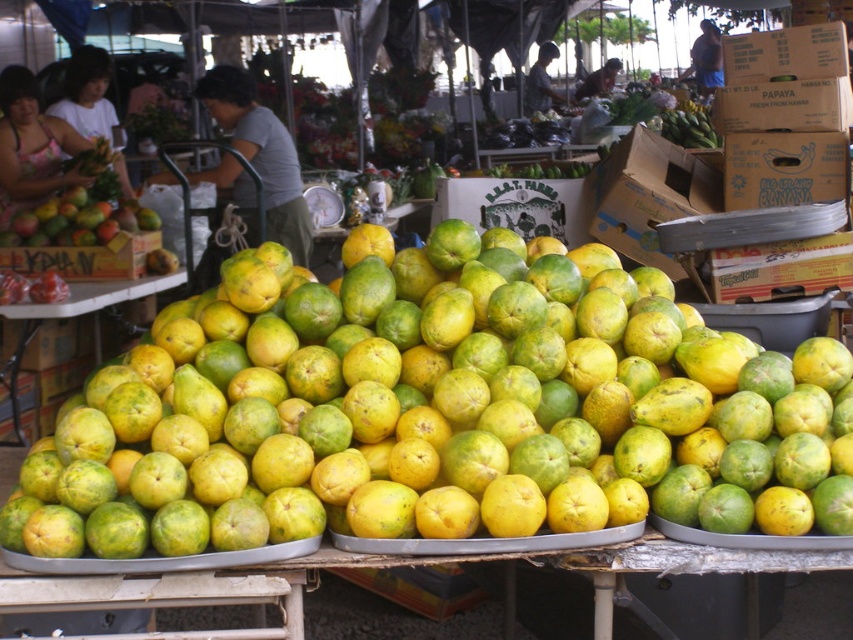
Who is positioned more to the right, green matte papaya at left or green matte papaya at center?

Positioned to the right is green matte papaya at center.

Can you confirm if green matte papaya at left is bigger than green matte papaya at center?

Actually, green matte papaya at left might be smaller than green matte papaya at center.

Who is more distant from viewer, (49, 237) or (99, 285)?

The point (49, 237) is behind.

The width and height of the screenshot is (853, 640). Identify the location of green matte papaya at left. (76, 221).

Between point (90, 252) and point (26, 316), which one is positioned in front?

Point (26, 316) is in front.

Between wooden crate at center and green matte papaya at center, which one appears on the right side from the viewer's perspective?

green matte papaya at center

Is point (109, 268) less distant than point (79, 298)?

No, it is not.

I want to click on wooden crate at center, so click(86, 259).

Does point (39, 208) come in front of point (83, 257)?

No, it is behind (83, 257).

Does green matte papaya at left have a lesser width compared to wooden crate at center?

In fact, green matte papaya at left might be wider than wooden crate at center.

You are a GUI agent. You are given a task and a screenshot of the screen. Output one action in this format:
    pyautogui.click(x=<x>, y=<y>)
    Task: Click on the green matte papaya at left
    The height and width of the screenshot is (640, 853).
    Given the screenshot: What is the action you would take?
    pyautogui.click(x=76, y=221)